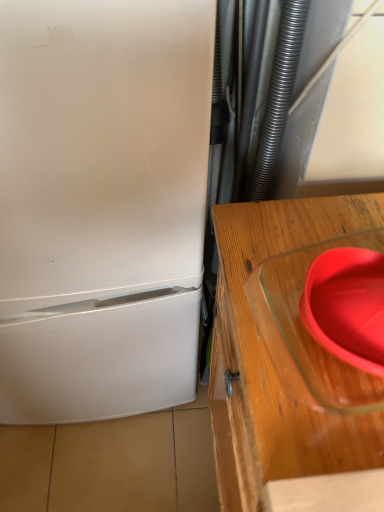
Identify the location of transparent glass table at right. tap(280, 366).

What do you see at coordinates (308, 333) in the screenshot?
I see `matte glass bowl at right` at bounding box center [308, 333].

Locate an element on the screen. Image resolution: width=384 pixels, height=512 pixels. transparent glass table at right is located at coordinates (280, 366).

Is point (165, 407) farther from viewer compared to point (266, 256)?

Yes, point (165, 407) is behind point (266, 256).

Is white matte refrigerator at left turned away from transparent glass table at right?

white matte refrigerator at left is not turned away from transparent glass table at right.

How many degrees apart are the facing directions of white matte refrigerator at left and transparent glass table at right?

They differ by 90 degrees in their facing directions.

Looking at their sizes, would you say white matte refrigerator at left is wider or thinner than transparent glass table at right?

In the image, white matte refrigerator at left appears to be more narrow than transparent glass table at right.

Is matte glass bowl at right at the back of transparent glass table at right?

No, transparent glass table at right is not facing the opposite direction of matte glass bowl at right.

Are transparent glass table at right and matte glass bowl at right far apart?

No.

Is transparent glass table at right bigger than matte glass bowl at right?

Indeed, transparent glass table at right has a larger size compared to matte glass bowl at right.

I want to click on table below the matte glass bowl at right (from the image's perspective), so click(x=280, y=366).

Which is in front, point (348, 241) or point (195, 282)?

Point (348, 241)

From a real-world perspective, which is physically below, matte glass bowl at right or white matte refrigerator at left?

white matte refrigerator at left.

In terms of height, does matte glass bowl at right look taller or shorter compared to white matte refrigerator at left?

matte glass bowl at right is shorter than white matte refrigerator at left.

Is there a large distance between white matte refrigerator at left and matte glass bowl at right?

That's not correct — white matte refrigerator at left is a little close to matte glass bowl at right.

Considering the relative positions of white matte refrigerator at left and matte glass bowl at right in the image provided, is white matte refrigerator at left to the left of matte glass bowl at right from the viewer's perspective?

Correct, you'll find white matte refrigerator at left to the left of matte glass bowl at right.

From the picture: Is white matte refrigerator at left positioned with its back to matte glass bowl at right?

That's not correct — white matte refrigerator at left is not looking away from matte glass bowl at right.

From a real-world perspective, is white matte refrigerator at left below matte glass bowl at right?

Yes, from a real-world perspective, white matte refrigerator at left is below matte glass bowl at right.

Is matte glass bowl at right completely or partially outside of transparent glass table at right?

matte glass bowl at right lies outside transparent glass table at right's area.

Is matte glass bowl at right facing towards transparent glass table at right?

No, matte glass bowl at right is not aimed at transparent glass table at right.

From the picture: From a real-world perspective, is matte glass bowl at right positioned above or below transparent glass table at right?

In terms of real-world spatial position, matte glass bowl at right is above transparent glass table at right.

Where is `appliance above the transparent glass table at right (from the image's perspective)`? This screenshot has width=384, height=512. appliance above the transparent glass table at right (from the image's perspective) is located at coordinates (308, 333).

This screenshot has height=512, width=384. I want to click on refrigerator on the left of transparent glass table at right, so click(x=101, y=205).

Can we say transparent glass table at right lies outside white matte refrigerator at left?

Indeed, transparent glass table at right is completely outside white matte refrigerator at left.

How many degrees apart are the facing directions of transparent glass table at right and white matte refrigerator at left?

The facing directions of transparent glass table at right and white matte refrigerator at left are 90 degrees apart.

Is transparent glass table at right not near white matte refrigerator at left?

That's not correct — transparent glass table at right is a little close to white matte refrigerator at left.

The height and width of the screenshot is (512, 384). I want to click on refrigerator above the transparent glass table at right (from the image's perspective), so click(101, 205).

Identify the location of appliance to the left of transparent glass table at right. This screenshot has height=512, width=384. [x=308, y=333].

Based on their spatial positions, is white matte refrigerator at left or matte glass bowl at right closer to transparent glass table at right?

Based on the image, matte glass bowl at right appears to be nearer to transparent glass table at right.

Based on their spatial positions, is matte glass bowl at right or white matte refrigerator at left further from transparent glass table at right?

white matte refrigerator at left is further to transparent glass table at right.

In the scene shown: When comparing their distances from matte glass bowl at right, does transparent glass table at right or white matte refrigerator at left seem further?

The object further to matte glass bowl at right is white matte refrigerator at left.

From the image, which object appears to be nearer to matte glass bowl at right, white matte refrigerator at left or transparent glass table at right?

transparent glass table at right is positioned closer to the anchor matte glass bowl at right.

Which object lies nearer to the anchor point white matte refrigerator at left, matte glass bowl at right or transparent glass table at right?

transparent glass table at right is positioned closer to the anchor white matte refrigerator at left.

Based on their spatial positions, is transparent glass table at right or matte glass bowl at right further from white matte refrigerator at left?

matte glass bowl at right is further to white matte refrigerator at left.

Where is `appliance located between white matte refrigerator at left and transparent glass table at right in the left-right direction`? appliance located between white matte refrigerator at left and transparent glass table at right in the left-right direction is located at coordinates [x=308, y=333].